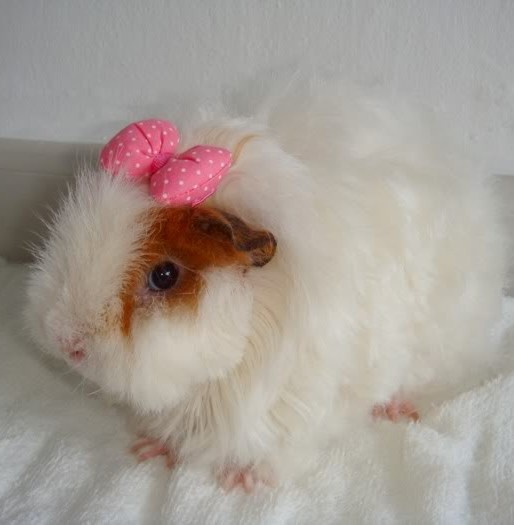
The height and width of the screenshot is (525, 514). What are the coordinates of `white fur` in the screenshot? It's located at click(x=362, y=244), click(x=75, y=270), click(x=137, y=348).